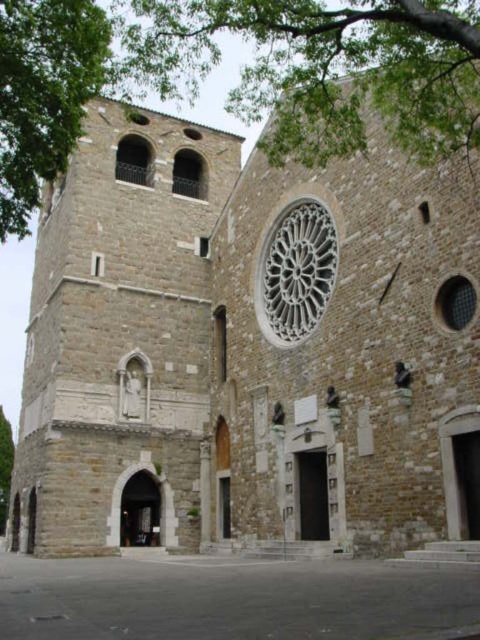
You are standing in front of the historic stone church and notice a green leafy tree at upper left. Can you estimate its coordinates in the image?

The green leafy tree at upper left is located at coordinates point (44,93).

You are standing in front of the historic stone church and notice the green leafy tree at upper left and the white stone rose window at center. Which object is located higher up in the image?

The green leafy tree at upper left is positioned over the white stone rose window at center, meaning it is higher up in the image.

You are an architect examining the church facade. You notice two green leafy trees in the upper sections of the image. Which tree, the green leafy tree at upper center or the green leafy tree at upper left, appears bigger in the scene?

The green leafy tree at upper center appears bigger than the green leafy tree at upper left in the scene.